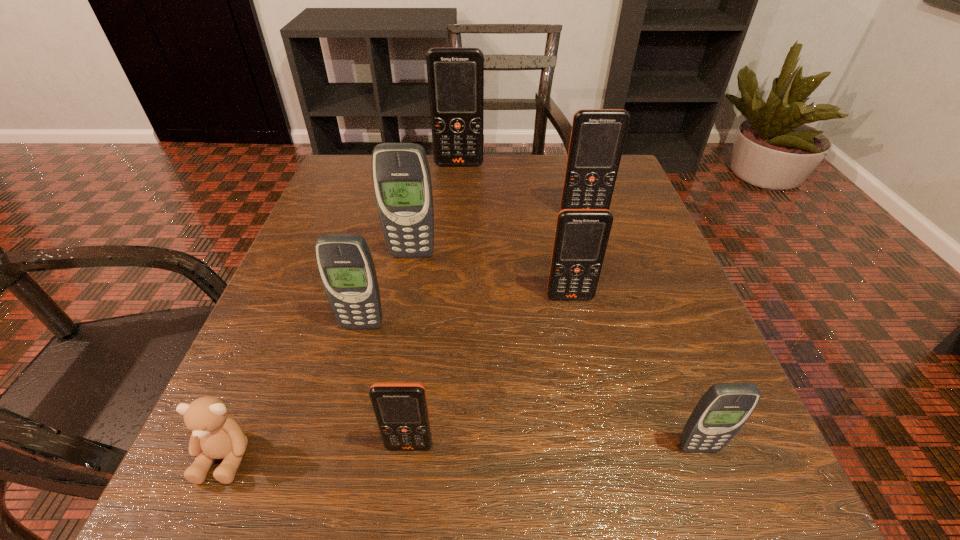
This screenshot has width=960, height=540. In order to click on teddy bear that is at the near edge in this screenshot , I will do pos(215,435).

At what (x,y) coordinates should I click in order to perform the action: click on cellular telephone situated at the left edge. Please return your answer as a coordinate pair (x, y). Looking at the image, I should click on (345, 264).

Where is `teddy bear that is at the left edge`? teddy bear that is at the left edge is located at coordinates (215, 435).

This screenshot has height=540, width=960. Find the location of `object that is at the near left corner`. object that is at the near left corner is located at coordinates (215, 435).

The width and height of the screenshot is (960, 540). What are the coordinates of `object that is at the far right corner` in the screenshot? It's located at (597, 139).

I want to click on object that is at the near right corner, so click(x=721, y=412).

You are a GUI agent. You are given a task and a screenshot of the screen. Output one action in this format:
    pyautogui.click(x=<x>, y=<y>)
    Task: Click on the free spot at the far edge of the desktop
    The width and height of the screenshot is (960, 540).
    Given the screenshot: What is the action you would take?
    pyautogui.click(x=501, y=158)

You are a GUI agent. You are given a task and a screenshot of the screen. Output one action in this format:
    pyautogui.click(x=<x>, y=<y>)
    Task: Click on the vacant space at the near edge of the desktop
    
    Given the screenshot: What is the action you would take?
    pyautogui.click(x=416, y=499)

Locate an element on the screen. free location at the left edge is located at coordinates (304, 381).

Identify the location of blank space at the right edge of the desktop. The width and height of the screenshot is (960, 540). (633, 382).